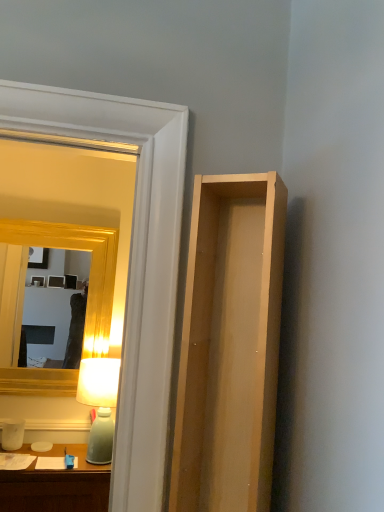
Locate an element on the screen. This screenshot has width=384, height=512. free point above clear glass door at upper left (from a real-world perspective) is located at coordinates (70, 84).